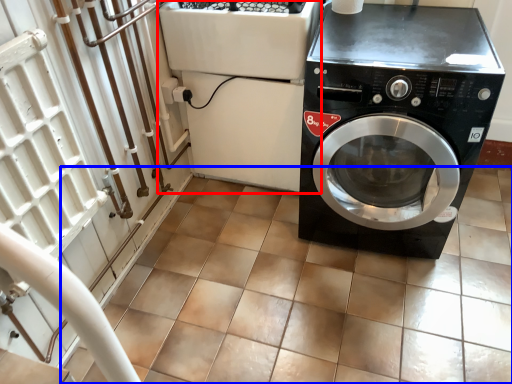
Question: Which point is closer to the camera, appliance (highlighted by a red box) or tile (highlighted by a blue box)?

Choices:
 (A) appliance
 (B) tile

Answer: (B)